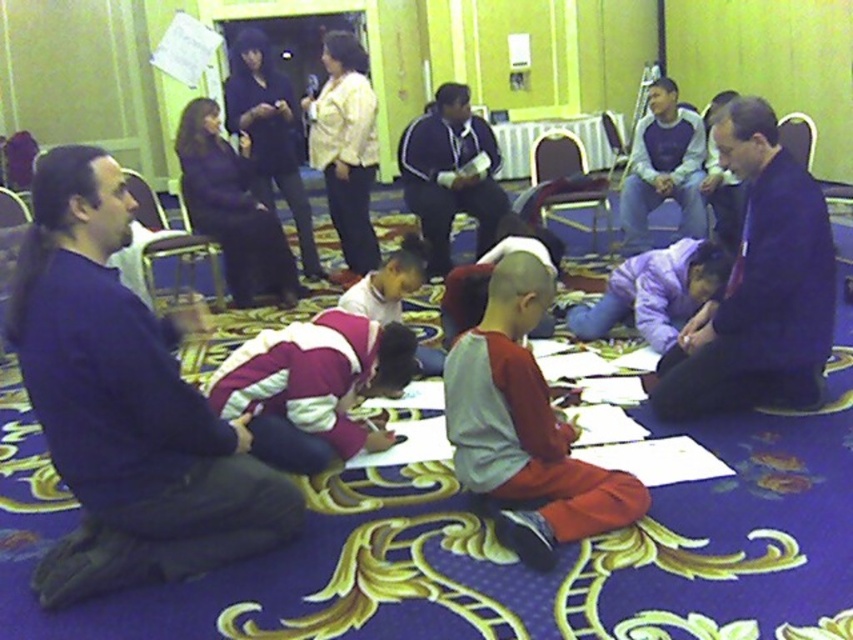
Is the position of purple sweater at left less distant than that of dark blue fabric at center?

Yes, purple sweater at left is closer to the viewer.

Who is lower down, purple sweater at left or dark blue fabric at center?

Positioned lower is purple sweater at left.

Does point (129, 346) come behind point (782, 301)?

No.

Find the location of `purple sweater at left`. purple sweater at left is located at coordinates (125, 403).

Which is above, purple sweater at left or gray fleece sweater at center?

purple sweater at left

In the scene shown: Who is lower down, purple sweater at left or gray fleece sweater at center?

Positioned lower is gray fleece sweater at center.

The height and width of the screenshot is (640, 853). Describe the element at coordinates (125, 403) in the screenshot. I see `purple sweater at left` at that location.

Locate an element on the screen. The width and height of the screenshot is (853, 640). purple sweater at left is located at coordinates (125, 403).

What do you see at coordinates (125, 403) in the screenshot?
I see `purple sweater at left` at bounding box center [125, 403].

Between purple sweater at left and gray sweatshirt at center, which one has more height?

gray sweatshirt at center

Where is `purple sweater at left`? This screenshot has height=640, width=853. purple sweater at left is located at coordinates (125, 403).

Where is `purple sweater at left`? purple sweater at left is located at coordinates (125, 403).